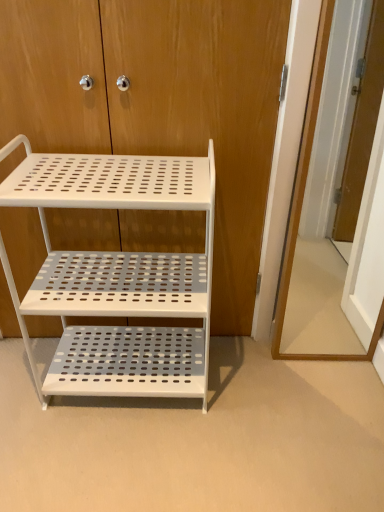
I want to click on free region under wooden door at right (from a real-world perspective), so coord(318,352).